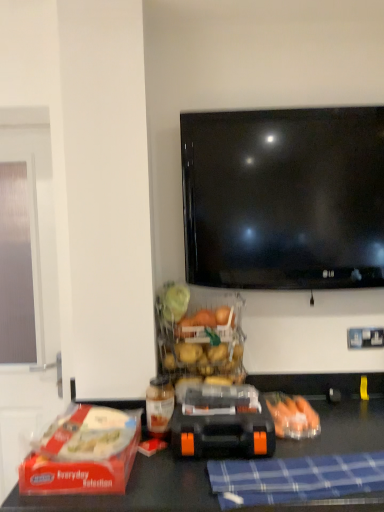
Question: Is there a large distance between orange rubber toy car at center and translucent plastic carrots at lower right?

Choices:
 (A) no
 (B) yes

Answer: (A)

Question: Is orange rubber toy car at center positioned before translucent plastic carrots at lower right?

Choices:
 (A) no
 (B) yes

Answer: (B)

Question: Would you say orange rubber toy car at center is outside translucent plastic carrots at lower right?

Choices:
 (A) yes
 (B) no

Answer: (A)

Question: Can you confirm if orange rubber toy car at center is smaller than translucent plastic carrots at lower right?

Choices:
 (A) no
 (B) yes

Answer: (A)

Question: Is orange rubber toy car at center aimed at translucent plastic carrots at lower right?

Choices:
 (A) no
 (B) yes

Answer: (A)

Question: Considering the relative sizes of orange rubber toy car at center and translucent plastic carrots at lower right in the image provided, is orange rubber toy car at center bigger than translucent plastic carrots at lower right?

Choices:
 (A) yes
 (B) no

Answer: (A)

Question: Is orange rubber toy car at center smaller than red plastic lunch box at lower left?

Choices:
 (A) no
 (B) yes

Answer: (B)

Question: Is orange rubber toy car at center to the left of red plastic lunch box at lower left from the viewer's perspective?

Choices:
 (A) no
 (B) yes

Answer: (A)

Question: Would you say orange rubber toy car at center is outside red plastic lunch box at lower left?

Choices:
 (A) no
 (B) yes

Answer: (B)

Question: Would you say orange rubber toy car at center contains red plastic lunch box at lower left?

Choices:
 (A) yes
 (B) no

Answer: (B)

Question: Does orange rubber toy car at center appear on the right side of red plastic lunch box at lower left?

Choices:
 (A) no
 (B) yes

Answer: (B)

Question: Considering the relative positions of orange rubber toy car at center and red plastic lunch box at lower left in the image provided, is orange rubber toy car at center in front of red plastic lunch box at lower left?

Choices:
 (A) yes
 (B) no

Answer: (B)

Question: Is red plastic lunch box at lower left outside blue checkered cloth at lower center?

Choices:
 (A) yes
 (B) no

Answer: (A)